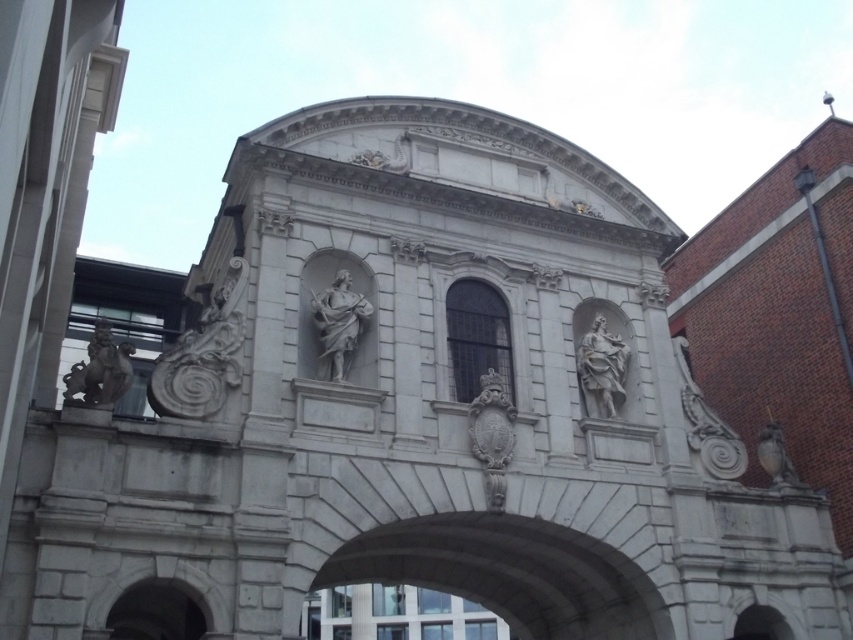
Is white stone carving at upper left further to the viewer compared to clear glass window at center?

No, it is not.

Find the location of a particular element. white stone carving at upper left is located at coordinates [202, 353].

Can you confirm if white marble statue at center is thinner than white marble statue at right?

No, white marble statue at center is not thinner than white marble statue at right.

Which is above, white marble statue at center or white marble statue at right?

white marble statue at center is above.

The height and width of the screenshot is (640, 853). Identify the location of white marble statue at center. click(338, 324).

Where is `white marble statue at center`? This screenshot has height=640, width=853. white marble statue at center is located at coordinates click(x=338, y=324).

Measure the distance between clear glass window at center and white marble statue at right.

A distance of 8.61 meters exists between clear glass window at center and white marble statue at right.

This screenshot has height=640, width=853. What are the coordinates of `clear glass window at center` in the screenshot? It's located at pos(476,337).

You are a GUI agent. You are given a task and a screenshot of the screen. Output one action in this format:
    pyautogui.click(x=<x>, y=<y>)
    Task: Click on the clear glass window at center
    The image size is (853, 640).
    Given the screenshot: What is the action you would take?
    pyautogui.click(x=476, y=337)